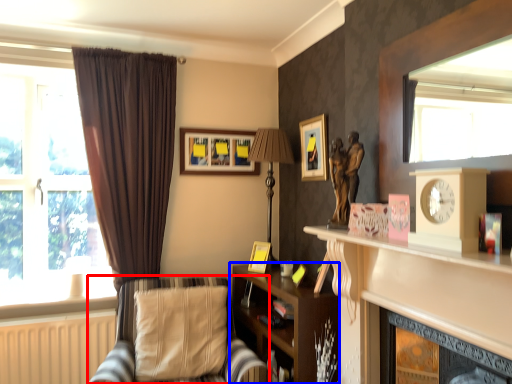
Question: Among these objects, which one is farthest to the camera, chair (highlighted by a red box) or shelf (highlighted by a blue box)?

Choices:
 (A) chair
 (B) shelf

Answer: (B)